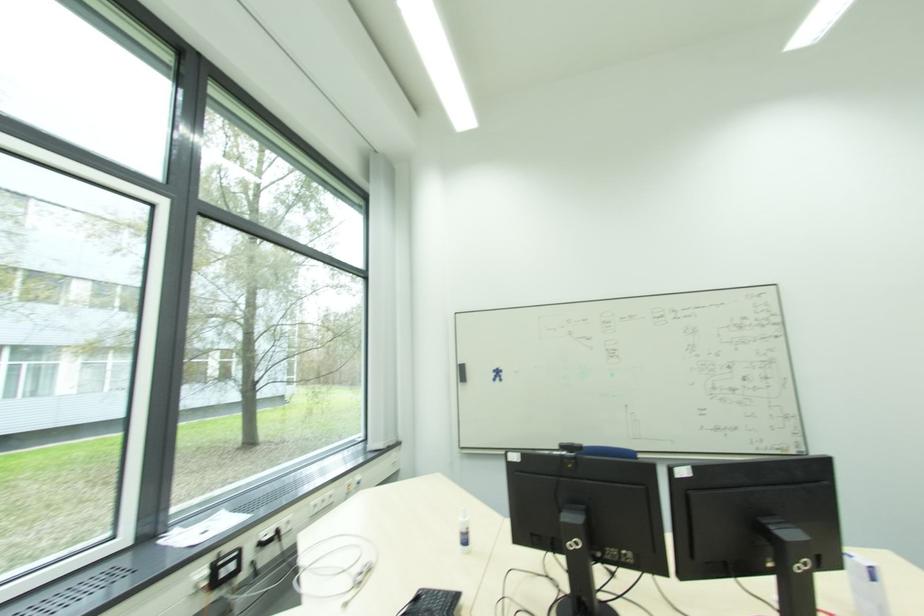
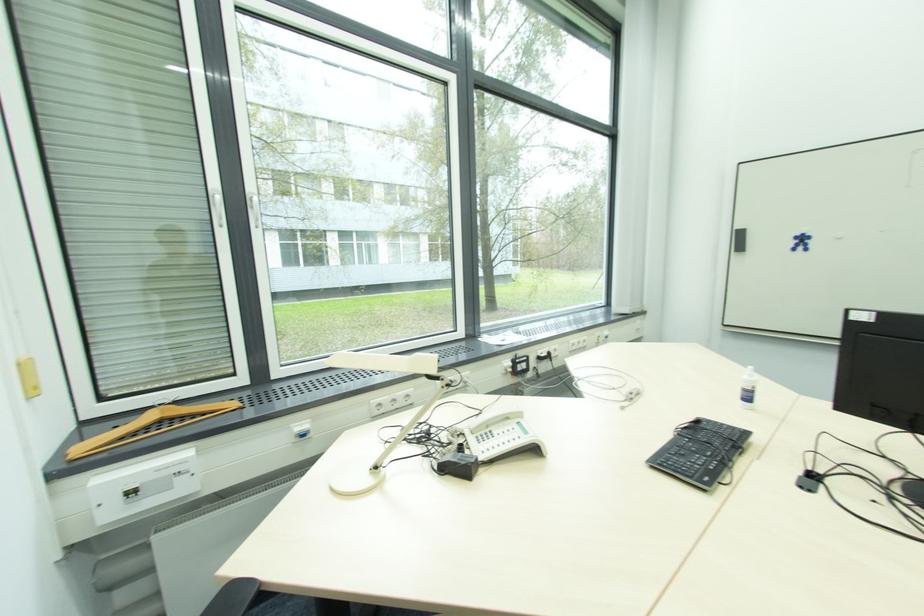
In the second image, find the point that corresponds to point 468,543 in the first image.

(750, 400)